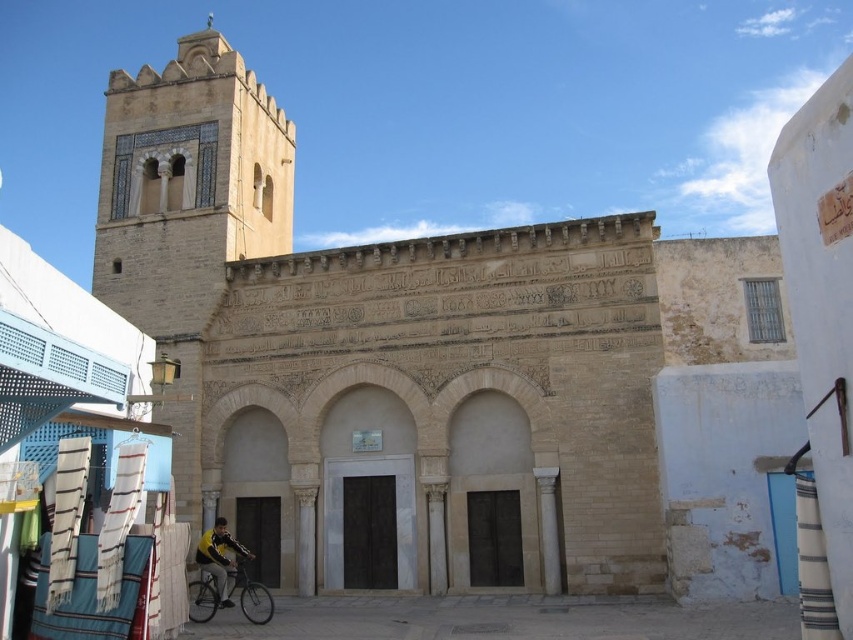
Consider the image. Is silver metallic bicycle at lower left shorter than yellow fabric jacket at lower left?

Answer: No, silver metallic bicycle at lower left is not shorter than yellow fabric jacket at lower left.

Looking at this image, which is above, silver metallic bicycle at lower left or yellow fabric jacket at lower left?

Positioned higher is yellow fabric jacket at lower left.

Where is `silver metallic bicycle at lower left`? silver metallic bicycle at lower left is located at coordinates (251, 595).

Identify the location of silver metallic bicycle at lower left. (251, 595).

Does beige stone church at center have a greater height compared to silver metallic bicycle at lower left?

Yes.

This screenshot has width=853, height=640. I want to click on beige stone church at center, so click(379, 360).

Between point (178, 452) and point (244, 611), which one is positioned behind?

The point (178, 452) is more distant.

The height and width of the screenshot is (640, 853). I want to click on beige stone church at center, so click(379, 360).

This screenshot has height=640, width=853. What do you see at coordinates (379, 360) in the screenshot?
I see `beige stone church at center` at bounding box center [379, 360].

Which is below, beige stone church at center or yellow fabric jacket at lower left?

yellow fabric jacket at lower left

The height and width of the screenshot is (640, 853). In order to click on beige stone church at center in this screenshot , I will do `click(379, 360)`.